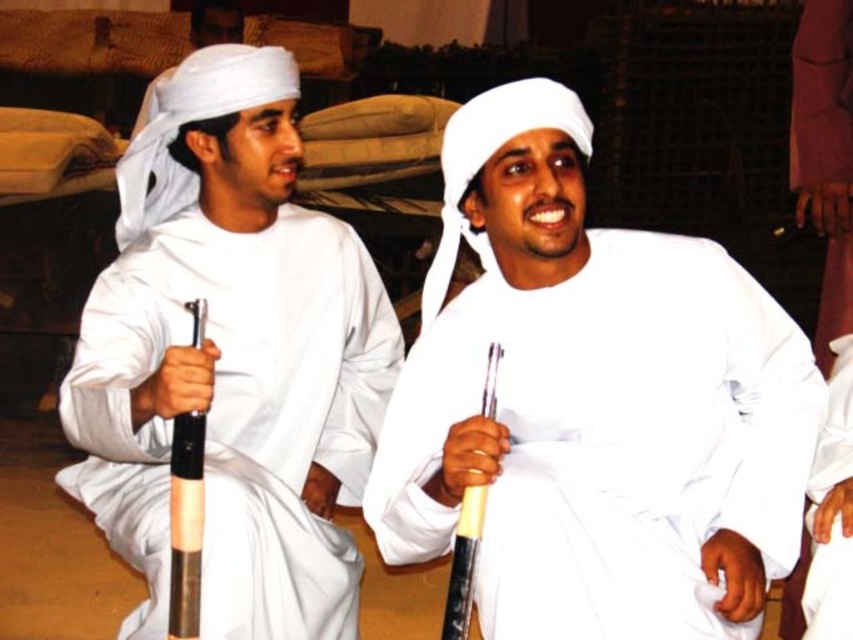
Does white matte/soft cloth at center appear under white matte/soft cloth at left?

Correct, white matte/soft cloth at center is located below white matte/soft cloth at left.

Who is more forward, [759,401] or [199,248]?

Point [759,401]

Locate an element on the screen. white matte/soft cloth at center is located at coordinates (593, 403).

Is white matte/soft cloth at center positioned before white matte robe at center?

Yes.

Does white matte/soft cloth at center have a smaller size compared to white matte robe at center?

Actually, white matte/soft cloth at center might be larger than white matte robe at center.

This screenshot has height=640, width=853. What do you see at coordinates (593, 403) in the screenshot?
I see `white matte/soft cloth at center` at bounding box center [593, 403].

Locate an element on the screen. This screenshot has width=853, height=640. white matte/soft cloth at center is located at coordinates (593, 403).

Between point (328, 598) and point (836, 480), which one is positioned in front?

Positioned in front is point (836, 480).

Is point (143, 150) more distant than point (831, 515)?

Yes, it is.

The width and height of the screenshot is (853, 640). I want to click on white matte/soft cloth at left, so click(231, 358).